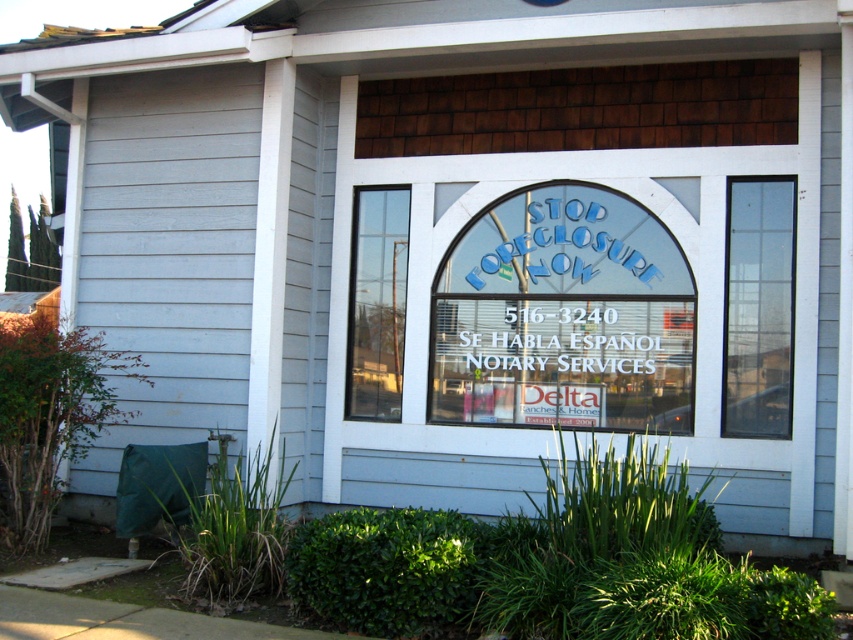
You are standing in front of the building and want to locate the clear glass window at right. Can you tell me its exact coordinates based on the image?

The clear glass window at right is located at coordinates point (758, 307).

You are a customer approaching the building and want to enter through the clear glass door at center. There is a white plastic sign at center in front of you. Can you walk around the sign to reach the door?

The white plastic sign at center is closer to the viewer than the clear glass door at center, so you can walk around the sign to reach the door since it is in front of you.

You are standing in front of the building and notice two points marked on the window. The first point is at coordinates point (488, 332) and the second is at point (401, 198). From your perspective, which point is closer to you?

Point (488, 332) is in front of point (401, 198), so it is closer to you.